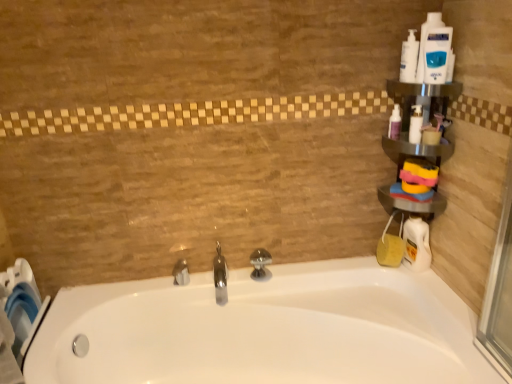
The width and height of the screenshot is (512, 384). What do you see at coordinates (437, 54) in the screenshot?
I see `white glossy bottle at upper right, which is the 4th cleaning product from bottom to top` at bounding box center [437, 54].

This screenshot has height=384, width=512. Describe the element at coordinates (220, 276) in the screenshot. I see `polished chrome faucet at center, which is counted as the 2th tap, starting from the left` at that location.

Describe the element at coordinates (394, 123) in the screenshot. I see `translucent plastic bottle at upper right, arranged as the 3th cleaning product when ordered from the bottom` at that location.

At what (x,y) coordinates should I click in order to perform the action: click on silver metallic tap at center, marked as the 1th tap in a left-to-right arrangement. Please return your answer as a coordinate pair (x, y). Image resolution: width=512 pixels, height=384 pixels. Looking at the image, I should click on (181, 273).

This screenshot has height=384, width=512. What do you see at coordinates (181, 273) in the screenshot?
I see `silver metallic tap at center, marked as the 1th tap in a left-to-right arrangement` at bounding box center [181, 273].

Measure the distance between metallic silver shelf at upper right and camera.

They are 4.69 feet apart.

Identify the location of white glossy bottle at upper right, placed as the 2th cleaning product when sorted from top to bottom. (437, 54).

Who is taller, metallic silver shelf at upper right or silver metallic tap at center, which is counted as the 3th tap, starting from the right?

metallic silver shelf at upper right is taller.

From the image's perspective, which one is positioned lower, metallic silver shelf at upper right or silver metallic tap at center, marked as the 1th tap in a left-to-right arrangement?

silver metallic tap at center, marked as the 1th tap in a left-to-right arrangement, is shown below in the image.

Looking at the image, does metallic silver shelf at upper right seem bigger or smaller compared to silver metallic tap at center, marked as the 1th tap in a left-to-right arrangement?

Considering their sizes, metallic silver shelf at upper right takes up more space than silver metallic tap at center, marked as the 1th tap in a left-to-right arrangement.

This screenshot has width=512, height=384. Identify the location of shelf in front of the silver metallic tap at center, which is counted as the 3th tap, starting from the right. (417, 148).

Does white glossy bottle at right, positioned as the first cleaning product in bottom-to-top order, have a larger size compared to white plastic bottle at upper right?

Correct, white glossy bottle at right, positioned as the first cleaning product in bottom-to-top order, is larger in size than white plastic bottle at upper right.

From the image's perspective, is white glossy bottle at right, the 5th cleaning product in the top-to-bottom sequence, under white plastic bottle at upper right?

Yes.

Image resolution: width=512 pixels, height=384 pixels. Identify the location of toiletry above the white glossy bottle at right, the 5th cleaning product in the top-to-bottom sequence (from a real-world perspective). (425, 42).

Is white glossy bottle at right, positioned as the first cleaning product in bottom-to-top order, looking in the opposite direction of white plastic bottle at upper right?

No, white plastic bottle at upper right is not at the back of white glossy bottle at right, positioned as the first cleaning product in bottom-to-top order.

Considering the sizes of objects metallic silver shelf at upper right and white plastic bottle at upper right in the image provided, who is taller, metallic silver shelf at upper right or white plastic bottle at upper right?

metallic silver shelf at upper right is taller.

Is metallic silver shelf at upper right oriented towards white plastic bottle at upper right?

No, metallic silver shelf at upper right is not oriented towards white plastic bottle at upper right.

Are metallic silver shelf at upper right and white plastic bottle at upper right beside each other?

No, metallic silver shelf at upper right is not touching white plastic bottle at upper right.

Identify the location of toiletry above the metallic silver shelf at upper right (from the image's perspective). (425, 42).

Can you confirm if metallic silver shelf at upper right is positioned to the right of white glossy bottle at upper right, placed as the 2th cleaning product when sorted from top to bottom?

No.

Is metallic silver shelf at upper right behind white glossy bottle at upper right, which is the 4th cleaning product from bottom to top?

Yes, metallic silver shelf at upper right is further from the viewer.

Can you confirm if silver metallic tap at center, which is counted as the 3th tap, starting from the right, is positioned to the left of white plastic bottle at upper right, the 4th cleaning product viewed from the top?

Yes, silver metallic tap at center, which is counted as the 3th tap, starting from the right, is to the left of white plastic bottle at upper right, the 4th cleaning product viewed from the top.

Is silver metallic tap at center, marked as the 1th tap in a left-to-right arrangement, completely or partially outside of white plastic bottle at upper right, the 4th cleaning product viewed from the top?

silver metallic tap at center, marked as the 1th tap in a left-to-right arrangement, lies outside white plastic bottle at upper right, the 4th cleaning product viewed from the top,'s area.

Is silver metallic tap at center, marked as the 1th tap in a left-to-right arrangement, positioned with its back to white plastic bottle at upper right, the second cleaning product when ordered from bottom to top?

silver metallic tap at center, marked as the 1th tap in a left-to-right arrangement, does not have its back to white plastic bottle at upper right, the second cleaning product when ordered from bottom to top.

How far apart are silver metallic tap at center, which is counted as the 3th tap, starting from the right, and white plastic bottle at upper right, the second cleaning product when ordered from bottom to top?

A distance of 1.04 meters exists between silver metallic tap at center, which is counted as the 3th tap, starting from the right, and white plastic bottle at upper right, the second cleaning product when ordered from bottom to top.

Based on their positions, is polished chrome tap at center, positioned as the 1th tap in right-to-left order, located to the left or right of white glossy bottle at upper right, placed as the 2th cleaning product when sorted from top to bottom?

polished chrome tap at center, positioned as the 1th tap in right-to-left order, is to the left of white glossy bottle at upper right, placed as the 2th cleaning product when sorted from top to bottom.

Can you confirm if polished chrome tap at center, positioned as the 1th tap in right-to-left order, is thinner than white glossy bottle at upper right, placed as the 2th cleaning product when sorted from top to bottom?

No.

Is polished chrome tap at center, arranged as the third tap when viewed from the left, not close to white glossy bottle at upper right, placed as the 2th cleaning product when sorted from top to bottom?

No, there isn't a large distance between polished chrome tap at center, arranged as the third tap when viewed from the left, and white glossy bottle at upper right, placed as the 2th cleaning product when sorted from top to bottom.

Looking at this image, does polished chrome tap at center, positioned as the 1th tap in right-to-left order, come in front of white glossy bottle at upper right, placed as the 2th cleaning product when sorted from top to bottom?

No, polished chrome tap at center, positioned as the 1th tap in right-to-left order, is further to the viewer.

From a real-world perspective, is polished chrome tap at center, arranged as the third tap when viewed from the left, physically below white plastic bottle at upper right, arranged as the fifth cleaning product when ordered from the bottom?

Yes, from a real-world perspective, polished chrome tap at center, arranged as the third tap when viewed from the left, is below white plastic bottle at upper right, arranged as the fifth cleaning product when ordered from the bottom.

Consider the image. Would you say polished chrome tap at center, arranged as the third tap when viewed from the left, is to the left or to the right of white plastic bottle at upper right, arranged as the fifth cleaning product when ordered from the bottom, in the picture?

From the image, it's evident that polished chrome tap at center, arranged as the third tap when viewed from the left, is to the left of white plastic bottle at upper right, arranged as the fifth cleaning product when ordered from the bottom.

From a real-world perspective, starting from the white plastic bottle at upper right, arranged as the fifth cleaning product when ordered from the bottom, which tap is the 1st one below it? Please provide its 2D coordinates.

[(260, 264)]

Starting from the metallic silver shelf at upper right, which tap is the 3rd one behind? Please provide its 2D coordinates.

[(181, 273)]

Locate an element on the screen. This screenshot has height=384, width=512. cleaning product that is the 5th one below the white plastic bottle at upper right (from a real-world perspective) is located at coordinates (416, 244).

When comparing their distances from white glossy bottle at right, the 5th cleaning product in the top-to-bottom sequence, does silver metallic tap at center, which is counted as the 3th tap, starting from the right, or white plastic bottle at upper right, arranged as the fifth cleaning product when ordered from the bottom, seem closer?

white plastic bottle at upper right, arranged as the fifth cleaning product when ordered from the bottom, is closer to white glossy bottle at right, the 5th cleaning product in the top-to-bottom sequence.

When comparing their distances from polished chrome faucet at center, marked as the second tap in a right-to-left arrangement, does white glossy bottle at upper right, placed as the 2th cleaning product when sorted from top to bottom, or white glossy bathtub at center seem closer?

white glossy bathtub at center is closer to polished chrome faucet at center, marked as the second tap in a right-to-left arrangement.

Which object lies nearer to the anchor point metallic silver shelf at upper right, silver metallic tap at center, which is counted as the 3th tap, starting from the right, or translucent plastic bottle at upper right, positioned as the 3th cleaning product in top-to-bottom order?

translucent plastic bottle at upper right, positioned as the 3th cleaning product in top-to-bottom order, is positioned closer to the anchor metallic silver shelf at upper right.

Looking at the image, which one is located closer to polished chrome tap at center, arranged as the third tap when viewed from the left, white glossy bottle at right, positioned as the first cleaning product in bottom-to-top order, or white plastic bottle at upper right, the 4th cleaning product viewed from the top?

Among the two, white glossy bottle at right, positioned as the first cleaning product in bottom-to-top order, is located nearer to polished chrome tap at center, arranged as the third tap when viewed from the left.

Based on the photo, estimate the real-world distances between objects in this image. Which object is further from translucent plastic bottle at upper right, arranged as the 3th cleaning product when ordered from the bottom, white glossy bottle at upper right, placed as the 2th cleaning product when sorted from top to bottom, or polished chrome faucet at center, which is counted as the 2th tap, starting from the left?

polished chrome faucet at center, which is counted as the 2th tap, starting from the left.

When comparing their distances from white plastic bottle at upper right, does metallic silver shelf at upper right or polished chrome faucet at center, which is counted as the 2th tap, starting from the left, seem further?

Based on the image, polished chrome faucet at center, which is counted as the 2th tap, starting from the left, appears to be further to white plastic bottle at upper right.

When comparing their distances from white plastic bottle at upper right, does polished chrome tap at center, positioned as the 1th tap in right-to-left order, or silver metallic tap at center, which is counted as the 3th tap, starting from the right, seem closer?

polished chrome tap at center, positioned as the 1th tap in right-to-left order, is closer to white plastic bottle at upper right.

Estimate the real-world distances between objects in this image. Which object is closer to polished chrome tap at center, positioned as the 1th tap in right-to-left order, metallic silver shelf at upper right or white glossy bottle at right, positioned as the first cleaning product in bottom-to-top order?

white glossy bottle at right, positioned as the first cleaning product in bottom-to-top order, lies closer to polished chrome tap at center, positioned as the 1th tap in right-to-left order, than the other object.

This screenshot has height=384, width=512. I want to click on shelf between translucent plastic bottle at upper right, arranged as the 3th cleaning product when ordered from the bottom, and white glossy bathtub at center, in the vertical direction, so [x=417, y=148].

Identify the location of bathtub between polished chrome faucet at center, marked as the second tap in a right-to-left arrangement, and white glossy bottle at right, positioned as the first cleaning product in bottom-to-top order, from left to right. Image resolution: width=512 pixels, height=384 pixels. (263, 330).

Where is `tap situated between polished chrome faucet at center, which is counted as the 2th tap, starting from the left, and metallic silver shelf at upper right from left to right`? The height and width of the screenshot is (384, 512). tap situated between polished chrome faucet at center, which is counted as the 2th tap, starting from the left, and metallic silver shelf at upper right from left to right is located at coordinates (260, 264).

At what (x,y) coordinates should I click in order to perform the action: click on tap between polished chrome faucet at center, marked as the second tap in a right-to-left arrangement, and translucent plastic bottle at upper right, positioned as the 3th cleaning product in top-to-bottom order, from left to right. Please return your answer as a coordinate pair (x, y). Looking at the image, I should click on (260, 264).